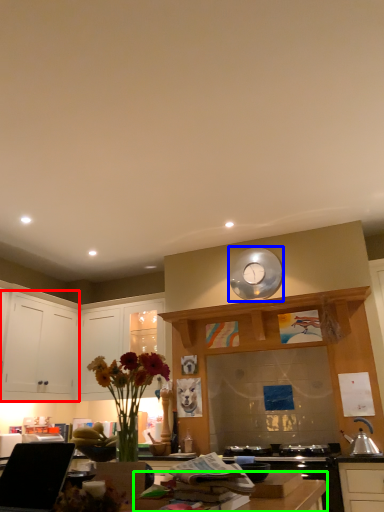
Question: Considering the real-world distances, which object is farthest from cabinetry (highlighted by a red box)? clock (highlighted by a blue box) or counter top (highlighted by a green box)?

Choices:
 (A) clock
 (B) counter top

Answer: (B)